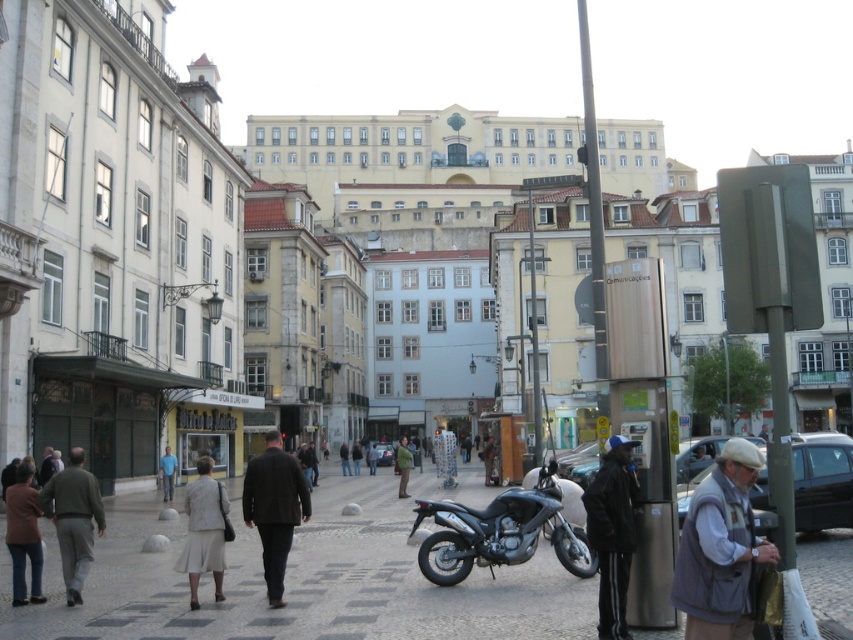
Is paved stone sidewalk at center positioned behind gray fabric vest at lower right?

Yes, it is.

Does paved stone sidewalk at center have a lesser width compared to gray fabric vest at lower right?

Incorrect, paved stone sidewalk at center's width is not less than gray fabric vest at lower right's.

Locate an element on the screen. The image size is (853, 640). paved stone sidewalk at center is located at coordinates (299, 580).

Find the location of `paved stone sidewalk at center`. paved stone sidewalk at center is located at coordinates (299, 580).

Which is behind, point (744, 445) or point (190, 497)?

Positioned behind is point (190, 497).

Is gray fabric vest at lower right wider than light beige fabric skirt at lower left?

In fact, gray fabric vest at lower right might be narrower than light beige fabric skirt at lower left.

Find the location of a particular element. The height and width of the screenshot is (640, 853). gray fabric vest at lower right is located at coordinates (720, 548).

How much distance is there between paved stone sidewalk at center and dark brown leather jacket at center?

paved stone sidewalk at center is 33.96 feet from dark brown leather jacket at center.

From the picture: Is paved stone sidewalk at center in front of dark brown leather jacket at center?

Yes, it is in front of dark brown leather jacket at center.

The height and width of the screenshot is (640, 853). What are the coordinates of `paved stone sidewalk at center` in the screenshot? It's located at (299, 580).

Identify the location of paved stone sidewalk at center. (299, 580).